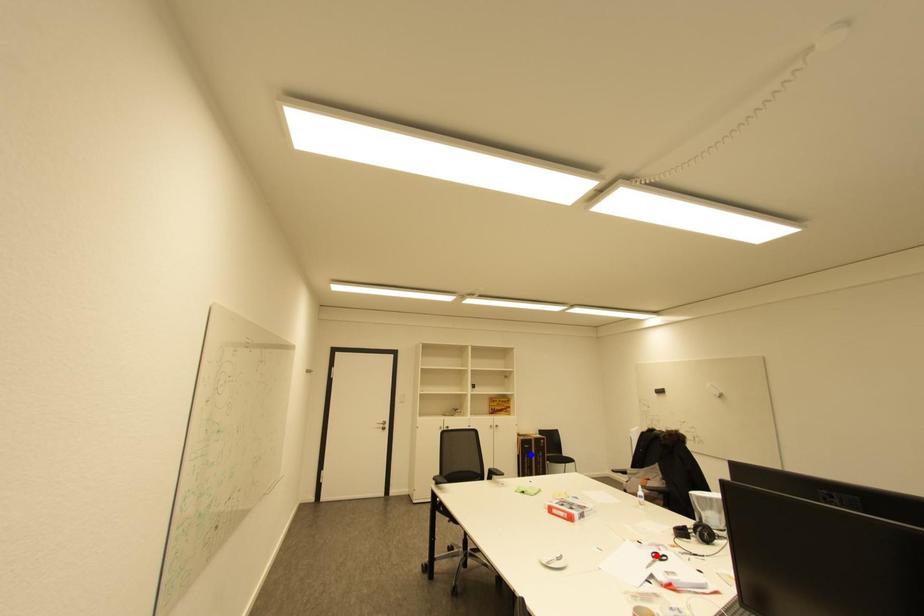
Question: Two points are marked on the image. Which point is closer to the camera?

Choices:
 (A) Blue point is closer.
 (B) Red point is closer.

Answer: (B)